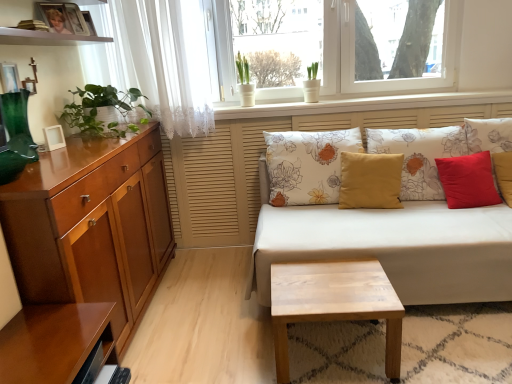
Question: Considering the positions of glossy wood shelf at lower left and glossy wood cabinet at left in the image, is glossy wood shelf at lower left bigger or smaller than glossy wood cabinet at left?

Choices:
 (A) small
 (B) big

Answer: (A)

Question: In the image, is glossy wood shelf at lower left on the left side or the right side of glossy wood cabinet at left?

Choices:
 (A) left
 (B) right

Answer: (B)

Question: Which object is the farthest from the light wood/texture coffee table at center?

Choices:
 (A) transparent glass window at upper center
 (B) green leafy plant at left
 (C) yellow fabric pillow at center, arranged as the third pillow when viewed from the left
 (D) matte yellow cushion at center, positioned as the 2th pillow in left-to-right order
 (E) white floral fabric couch at center

Answer: (A)

Question: Considering the real-world distances, which object is closest to the glossy wood shelf at lower left?

Choices:
 (A) light wood/texture coffee table at center
 (B) matte yellow cushion at center, which ranks as the fourth pillow in right-to-left order
 (C) glossy wood cabinet at left
 (D) white glossy pot at upper center
 (E) yellow fabric pillow at center, the third pillow viewed from the right

Answer: (C)